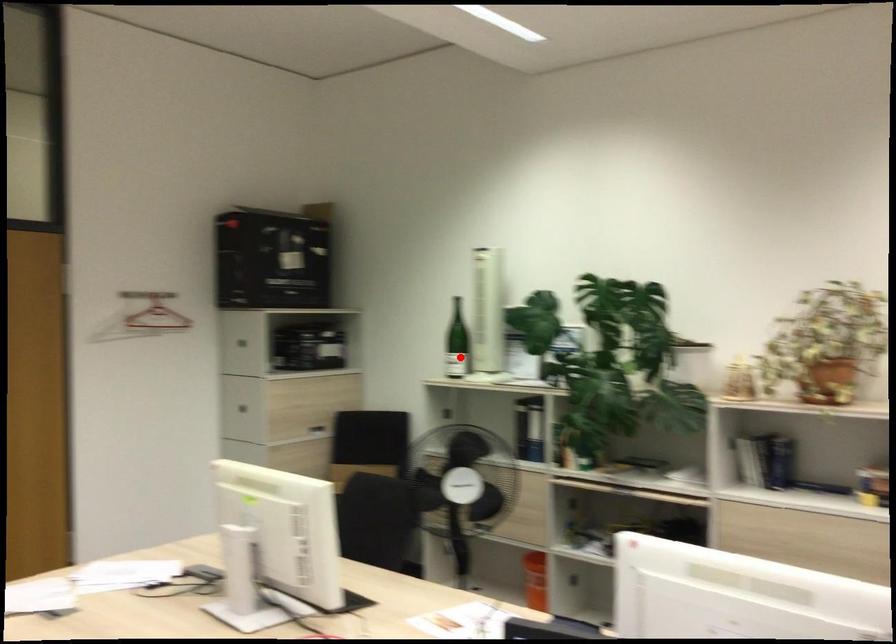
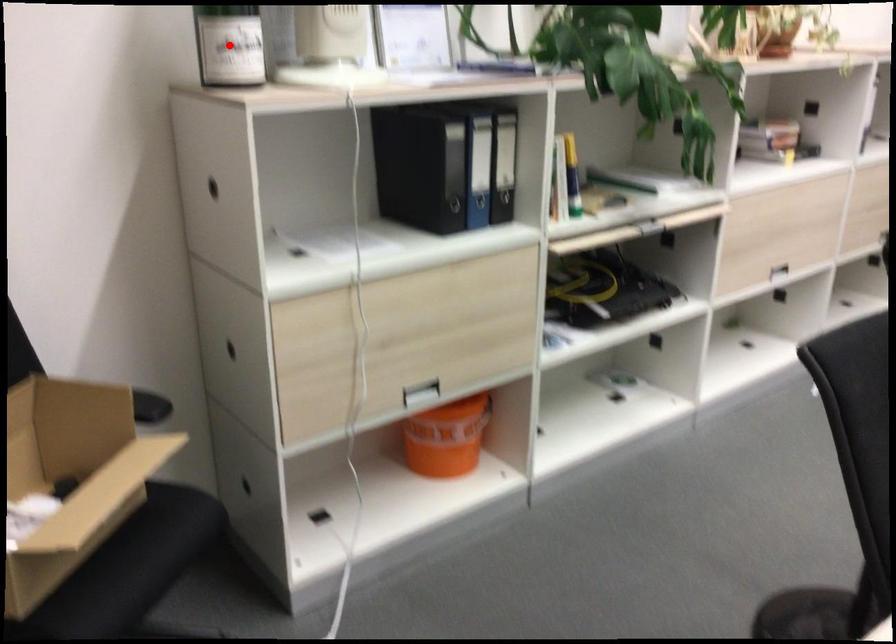
I am providing you with two images of the same scene from different viewpoints. A red point is marked on the first image and another point is marked on the second image. Do the highlighted points in image1 and image2 indicate the same real-world spot?

Yes